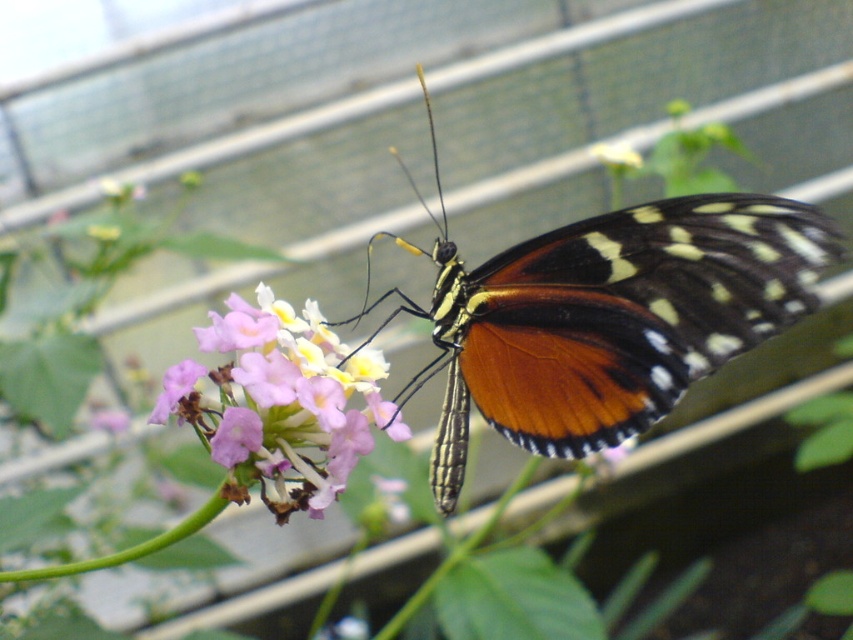
Question: Among these objects, which one is nearest to the camera?

Choices:
 (A) pink matte flower at center
 (B) orange iridescent wings at center

Answer: (B)

Question: Which of the following is the closest to the observer?

Choices:
 (A) orange iridescent wings at center
 (B) pink matte flower at center

Answer: (A)

Question: Can you confirm if orange iridescent wings at center is wider than pink matte flower at center?

Choices:
 (A) yes
 (B) no

Answer: (A)

Question: Does orange iridescent wings at center have a greater width compared to pink matte flower at center?

Choices:
 (A) yes
 (B) no

Answer: (A)

Question: From the image, what is the correct spatial relationship of orange iridescent wings at center in relation to pink matte flower at center?

Choices:
 (A) below
 (B) above

Answer: (B)

Question: Among these objects, which one is farthest from the camera?

Choices:
 (A) orange iridescent wings at center
 (B) pink matte flower at center

Answer: (B)